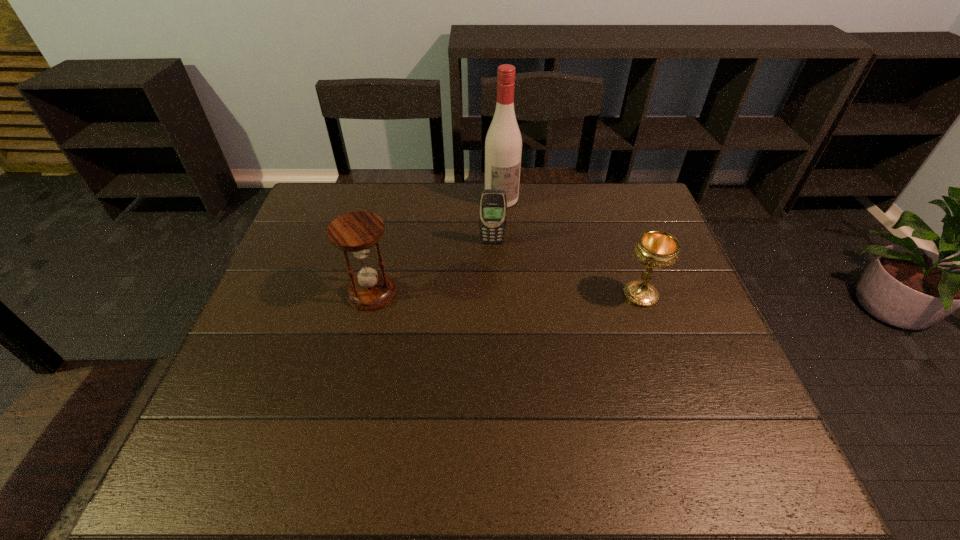
I want to click on free space located on the label of the farthest object, so click(x=516, y=232).

Find the location of a particular element. The width and height of the screenshot is (960, 540). free space located 0.160m on the screen of the second farthest object is located at coordinates (492, 284).

At what (x,y) coordinates should I click in order to perform the action: click on vacant space located 0.210m on the screen of the second farthest object. Please return your answer as a coordinate pair (x, y). Image resolution: width=960 pixels, height=540 pixels. Looking at the image, I should click on (492, 298).

In order to click on vacant area situated on the screen of the second farthest object in this screenshot , I will do `click(492, 298)`.

At what (x,y) coordinates should I click in order to perform the action: click on object that is at the far edge. Please return your answer as a coordinate pair (x, y). This screenshot has width=960, height=540. Looking at the image, I should click on (503, 145).

In order to click on object located in the right edge section of the desktop in this screenshot , I will do `click(656, 249)`.

At what (x,y) coordinates should I click in order to perform the action: click on vacant region at the far edge of the desktop. Please return your answer as a coordinate pair (x, y). The height and width of the screenshot is (540, 960). Looking at the image, I should click on (366, 202).

Where is `free space at the near edge of the desktop`? This screenshot has width=960, height=540. free space at the near edge of the desktop is located at coordinates click(595, 396).

You are a GUI agent. You are given a task and a screenshot of the screen. Output one action in this format:
    pyautogui.click(x=<x>, y=<y>)
    Task: Click on the vacant space at the left edge of the desktop
    The height and width of the screenshot is (540, 960).
    Given the screenshot: What is the action you would take?
    pyautogui.click(x=287, y=337)

Where is `vacant space at the right edge of the desktop`? This screenshot has width=960, height=540. vacant space at the right edge of the desktop is located at coordinates (671, 287).